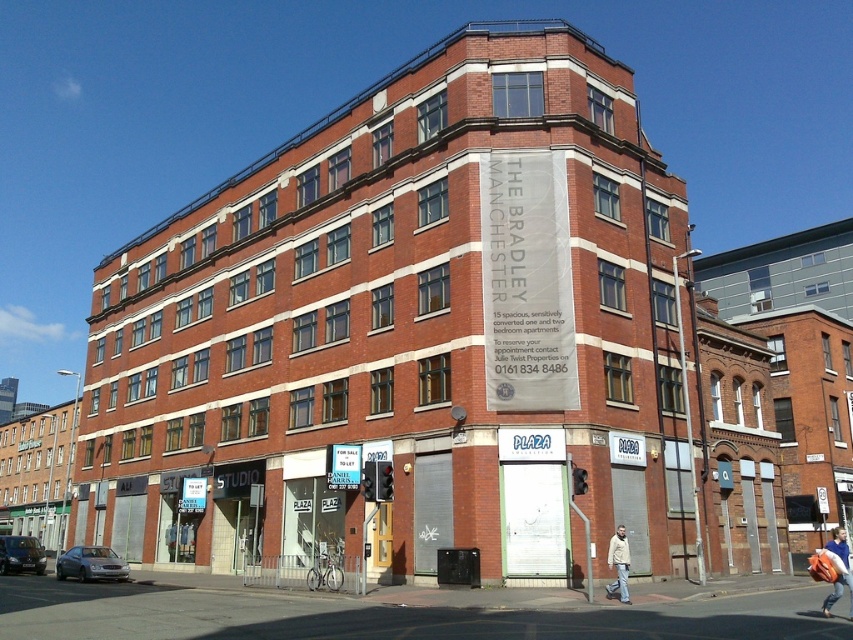
Can you confirm if blue denim jacket at lower right is positioned above beige fabric jacket at lower right?

No, blue denim jacket at lower right is not above beige fabric jacket at lower right.

Between point (851, 584) and point (624, 547), which one is positioned behind?

The point (624, 547) is more distant.

This screenshot has width=853, height=640. What do you see at coordinates (838, 570) in the screenshot?
I see `blue denim jacket at lower right` at bounding box center [838, 570].

The width and height of the screenshot is (853, 640). Find the location of `blue denim jacket at lower right`. blue denim jacket at lower right is located at coordinates (838, 570).